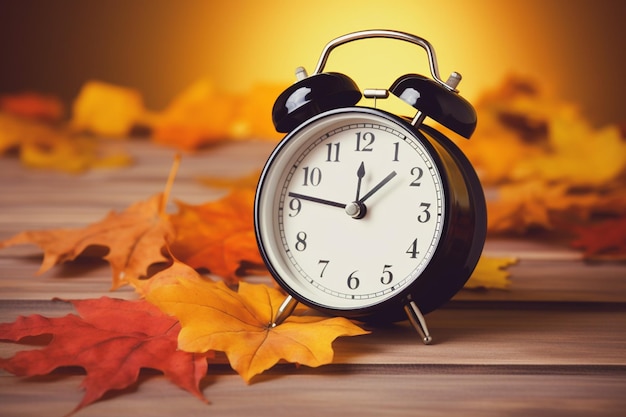
Find the location of `dark areas on wood surface`. dark areas on wood surface is located at coordinates (513, 371), (526, 301).